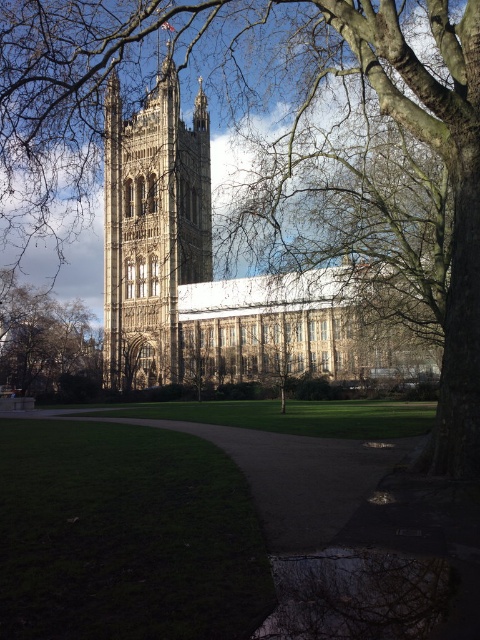
Can you confirm if golden stone tower at center is taller than brown gravel path at center?

Correct, golden stone tower at center is much taller as brown gravel path at center.

Is point (134, 296) more distant than point (325, 525)?

Yes, point (134, 296) is farther from viewer.

You are a GUI agent. You are given a task and a screenshot of the screen. Output one action in this format:
    pyautogui.click(x=<x>, y=<y>)
    Task: Click on the golden stone tower at center
    The height and width of the screenshot is (640, 480).
    Given the screenshot: What is the action you would take?
    pyautogui.click(x=152, y=228)

Does golden stone church at center appear on the right side of brown gravel path at center?

Incorrect, golden stone church at center is not on the right side of brown gravel path at center.

Is golden stone church at center below brown gravel path at center?

Incorrect, golden stone church at center is not positioned below brown gravel path at center.

The height and width of the screenshot is (640, 480). What do you see at coordinates (203, 269) in the screenshot?
I see `golden stone church at center` at bounding box center [203, 269].

This screenshot has height=640, width=480. I want to click on golden stone church at center, so click(203, 269).

Does golden stone tower at center come behind smooth bark tree at lower left?

No.

Is golden stone tower at center bigger than smooth bark tree at lower left?

Yes, golden stone tower at center is bigger than smooth bark tree at lower left.

Image resolution: width=480 pixels, height=640 pixels. In order to click on golden stone tower at center in this screenshot , I will do `click(152, 228)`.

What are the coordinates of `golden stone tower at center` in the screenshot? It's located at (152, 228).